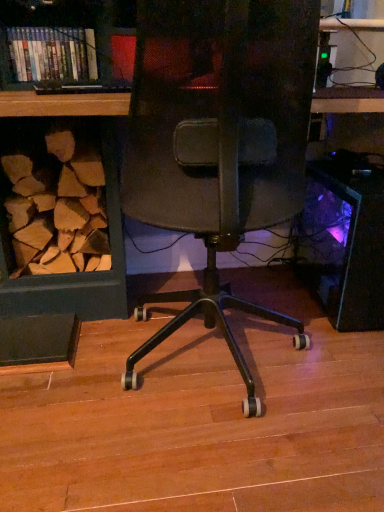
Identify the location of free space above hardcover books at upper left (from a real-world perspective). (51, 24).